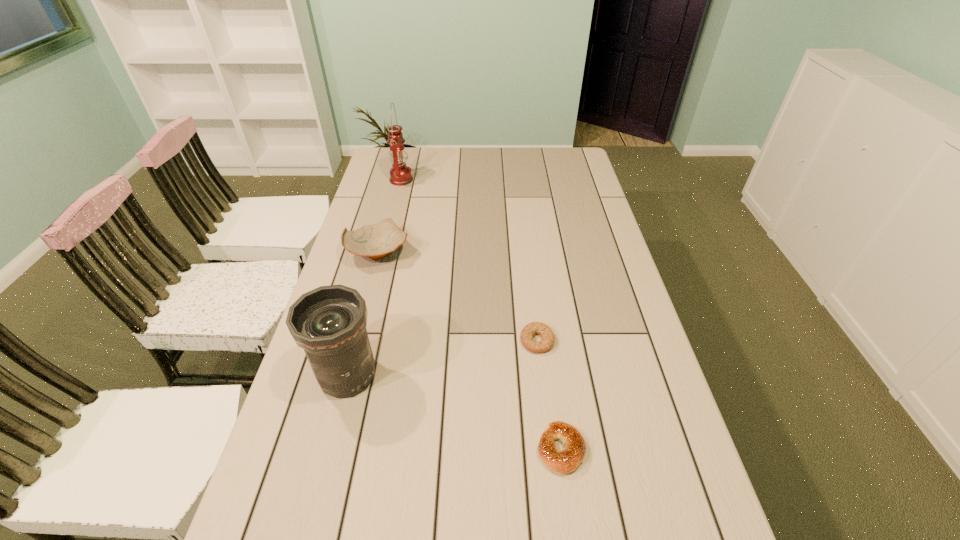
Image resolution: width=960 pixels, height=540 pixels. In order to click on vacant space that is in between the farthest object and the pottery in this screenshot , I will do `click(390, 217)`.

Find the location of a particular element. This screenshot has height=540, width=960. blank region between the second farthest object and the farther bagel is located at coordinates click(458, 296).

The image size is (960, 540). In order to click on free space between the farther bagel and the farthest object in this screenshot , I will do `click(469, 260)`.

At what (x,y) coordinates should I click in order to perform the action: click on unoccupied area between the nearer bagel and the tallest object. Please return your answer as a coordinate pair (x, y). This screenshot has height=540, width=960. Looking at the image, I should click on (481, 314).

Locate an element on the screen. free space between the telephoto lens and the farther bagel is located at coordinates (443, 358).

You are a GUI agent. You are given a task and a screenshot of the screen. Output one action in this format:
    pyautogui.click(x=<x>, y=<y>)
    Task: Click on the free point between the farther bagel and the nearer bagel
    Image resolution: width=960 pixels, height=540 pixels.
    Given the screenshot: What is the action you would take?
    (x=549, y=395)

This screenshot has height=540, width=960. Identify the location of vacant space that is in between the farthest object and the second farthest object. (390, 217).

At what (x,y) coordinates should I click in order to perform the action: click on free space between the second farthest object and the oil lamp. Please return your answer as a coordinate pair (x, y). The image size is (960, 540). Looking at the image, I should click on (390, 217).

The height and width of the screenshot is (540, 960). In order to click on vacant area that lies between the oil lamp and the pottery in this screenshot , I will do `click(390, 217)`.

Where is `free space between the tallest object and the farther bagel`? The image size is (960, 540). free space between the tallest object and the farther bagel is located at coordinates (469, 260).